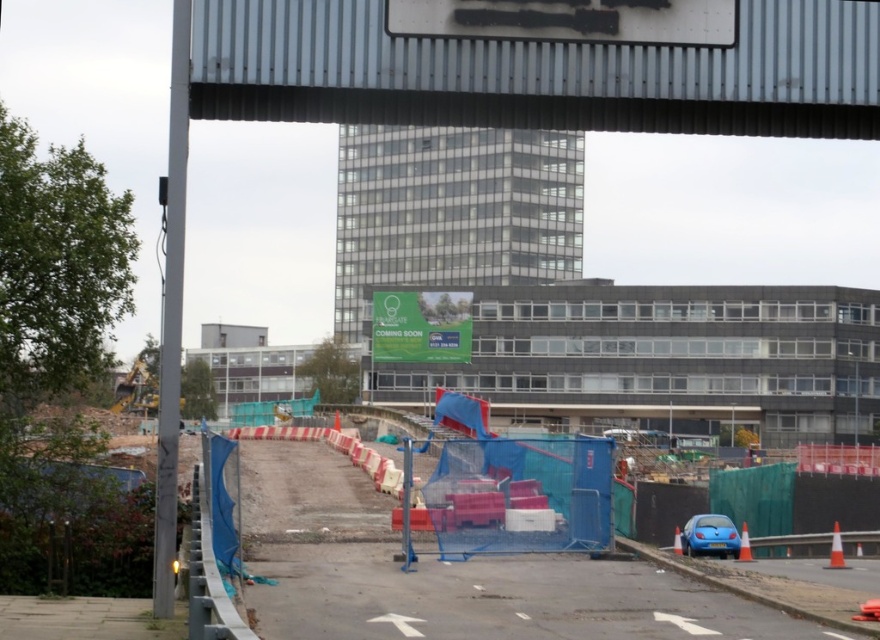
You are a delivery driver who needs to navigate through this construction site. You see a metallic gray overpass at upper center and a green fabric sign at center. Which object is closer to you?

The green fabric sign at center is closer to you because it is only 355.49 feet away from the metallic gray overpass at upper center, which is farther away.

You are a delivery driver who needs to park your truck near the construction site. You see the metallic gray overpass at upper center and the blue plastic container at center. Which object is positioned to the right side of the other?

The metallic gray overpass at upper center is to the right of the blue plastic container at center.

You are a delivery driver who needs to navigate through the construction site. You see the metallic gray overpass at upper center and the white plastic cone at lower right. Which object is positioned higher from the ground?

The metallic gray overpass at upper center is above the white plastic cone at lower right, so it is positioned higher from the ground.